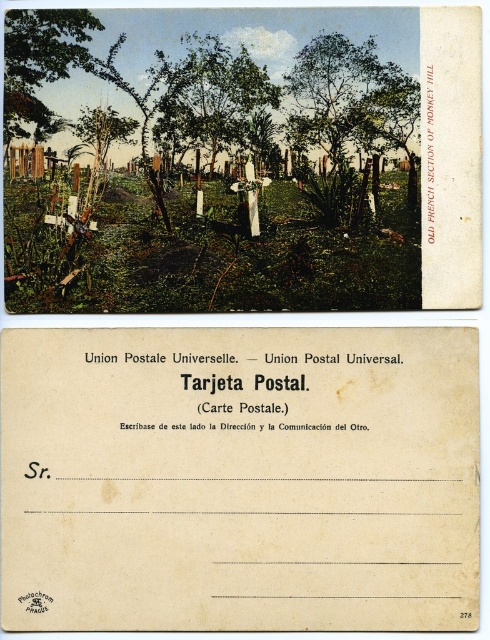
Question: Can you confirm if green leafy tree at upper center is positioned to the right of green leafy tree at upper left?

Choices:
 (A) no
 (B) yes

Answer: (B)

Question: From the image, what is the correct spatial relationship of green leafy tree at center in relation to green leafy tree at upper left?

Choices:
 (A) above
 (B) below

Answer: (B)

Question: Which of these objects is positioned closest to the off-white paper at center?

Choices:
 (A) green leafy tree at upper left
 (B) green leafy tree at upper center
 (C) green leafy tree at center

Answer: (C)

Question: Does off-white paper at center have a smaller size compared to green leafy tree at upper center?

Choices:
 (A) yes
 (B) no

Answer: (B)

Question: Considering the real-world distances, which object is farthest from the off-white paper at center?

Choices:
 (A) green leafy tree at center
 (B) green leafy tree at upper center

Answer: (B)

Question: Which of these objects is positioned farthest from the green leafy tree at center?

Choices:
 (A) green leafy tree at upper left
 (B) off-white paper at center
 (C) green leafy tree at upper center

Answer: (B)